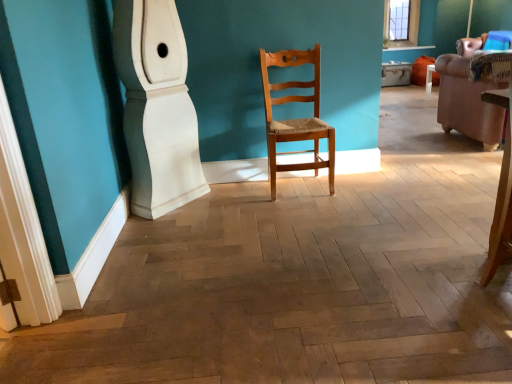
Question: From the image's perspective, relative to white glossy baseboard at lower left, is natural wood chair at center above or below?

Choices:
 (A) below
 (B) above

Answer: (A)

Question: Considering the positions of natural wood chair at center and white glossy baseboard at lower left in the image, is natural wood chair at center taller or shorter than white glossy baseboard at lower left?

Choices:
 (A) tall
 (B) short

Answer: (B)

Question: Estimate the real-world distances between objects in this image. Which object is farther from the natural wood chair at center?

Choices:
 (A) brown leather armchair at right
 (B) white glossy baseboard at lower left

Answer: (A)

Question: Which object is positioned closest to the white glossy baseboard at lower left?

Choices:
 (A) brown leather armchair at right
 (B) natural wood chair at center

Answer: (B)